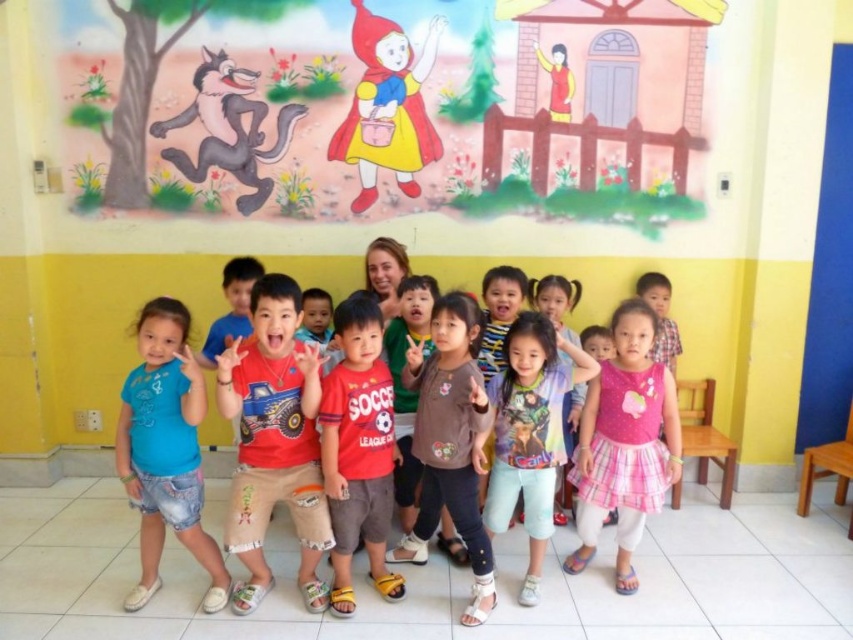
You are standing at the position of point (x=439, y=330) and want to move towards the door located at point (x=605, y=476). Is there a clear path between these two points?

Point (x=605, y=476) is behind point (x=439, y=330), so there might be an obstruction between them. You should check for any objects blocking the path before moving forward.

You are a photographer trying to adjust the lighting for a group photo. You notice two people in the foreground wearing a pink plaid dress at center and light blue denim pants at center. Which clothing item is positioned higher in the image?

The pink plaid dress at center is much taller as light blue denim pants at center, so the pink plaid dress at center is positioned higher in the image.